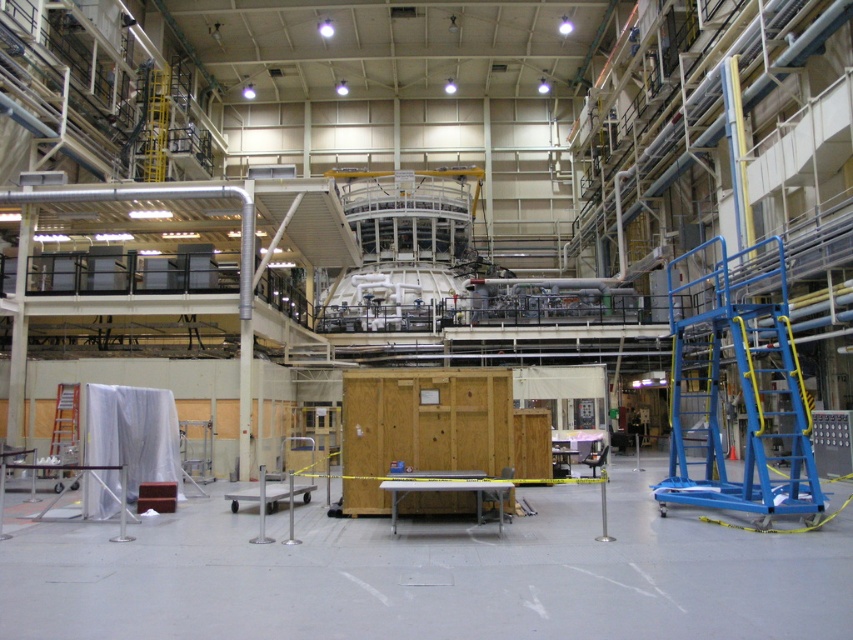
Question: Can you confirm if blue metallic platform at right is positioned to the left of silver metallic ladder at left?

Choices:
 (A) no
 (B) yes

Answer: (A)

Question: Does blue metallic platform at right lie in front of silver metallic ladder at left?

Choices:
 (A) no
 (B) yes

Answer: (B)

Question: Which point is farther to the camera?

Choices:
 (A) (445, 490)
 (B) (788, 356)
 (C) (56, 440)

Answer: (C)

Question: Is metallic gray table at center above silver metallic ladder at left?

Choices:
 (A) no
 (B) yes

Answer: (A)

Question: Which of these objects is positioned farthest from the blue metallic platform at right?

Choices:
 (A) silver metallic ladder at left
 (B) metallic gray table at center

Answer: (A)

Question: Which point is closer to the camera?

Choices:
 (A) blue metallic platform at right
 (B) metallic gray table at center
 (C) silver metallic ladder at left

Answer: (B)